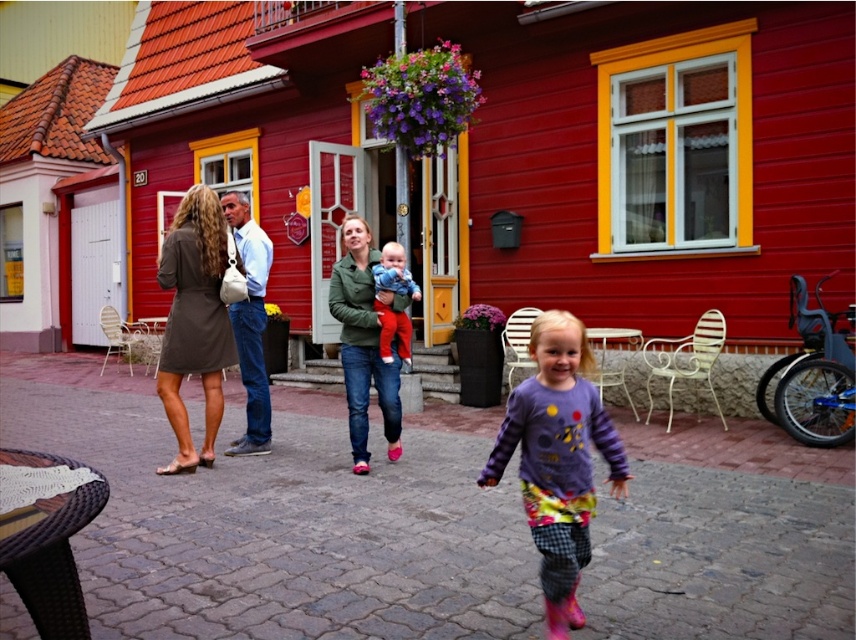
Identify the location of matte brown dress at center. (194, 321).

Can you confirm if matte brown dress at center is positioned above green matte jacket at center?

Yes.

Is point (179, 444) farther from camera compared to point (346, 234)?

That is False.

At what (x,y) coordinates should I click in order to perform the action: click on matte brown dress at center. Please return your answer as a coordinate pair (x, y). This screenshot has height=640, width=856. Looking at the image, I should click on (194, 321).

Does green matte jacket at center have a lesser height compared to matte blue sweater at center?

Incorrect, green matte jacket at center's height does not fall short of matte blue sweater at center's.

What do you see at coordinates (364, 340) in the screenshot?
I see `green matte jacket at center` at bounding box center [364, 340].

Does point (364, 243) lie in front of point (403, 352)?

Yes, point (364, 243) is closer to viewer.

Find the location of a particular element. The height and width of the screenshot is (640, 856). green matte jacket at center is located at coordinates (364, 340).

Can you confirm if matte brown dress at center is wider than matte blue sweater at center?

Yes, matte brown dress at center is wider than matte blue sweater at center.

Does matte brown dress at center appear over matte blue sweater at center?

No, matte brown dress at center is not above matte blue sweater at center.

Which is behind, point (218, 420) or point (377, 304)?

Positioned behind is point (218, 420).

Locate an element on the screen. The width and height of the screenshot is (856, 640). matte brown dress at center is located at coordinates (194, 321).